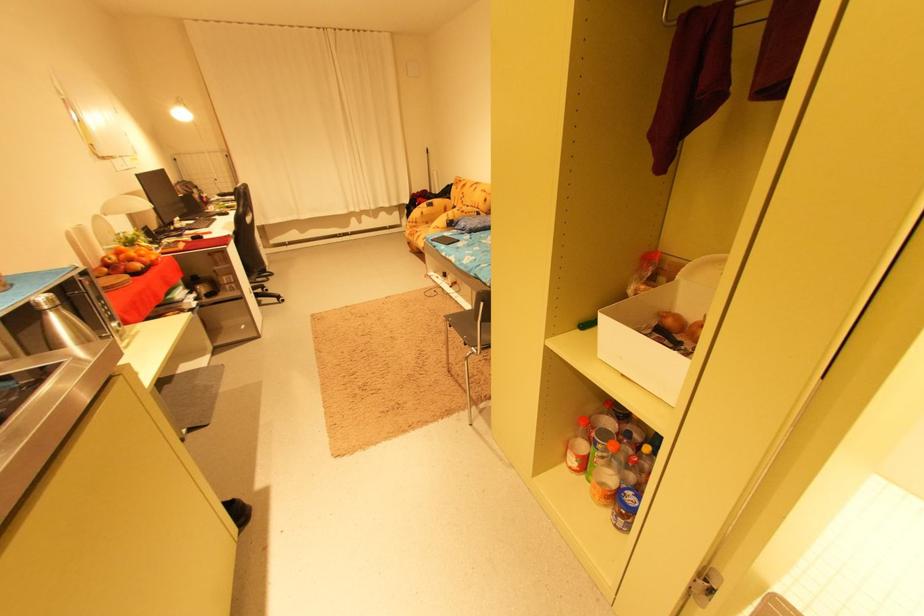
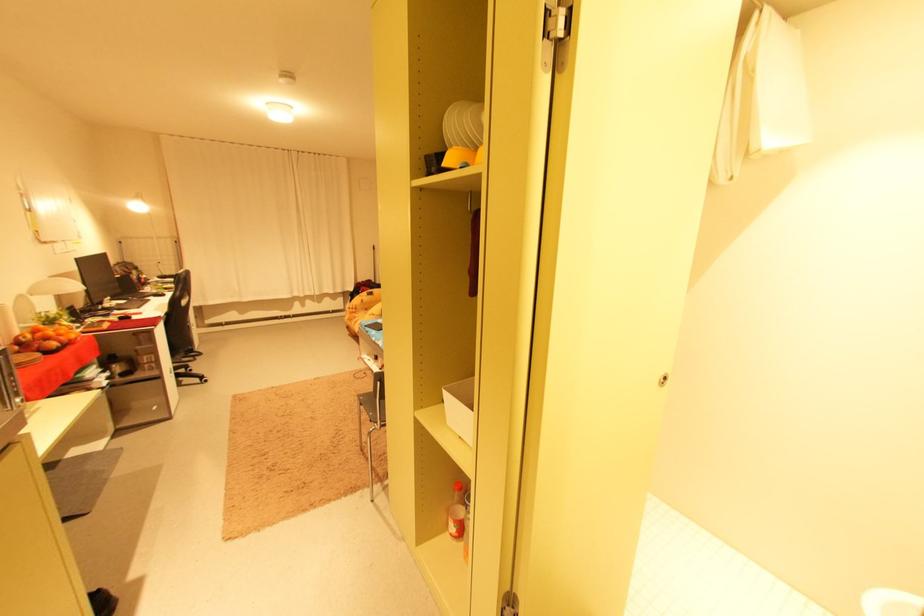
In the second image, find the point that corresponds to (629,376) in the first image.

(467, 438)